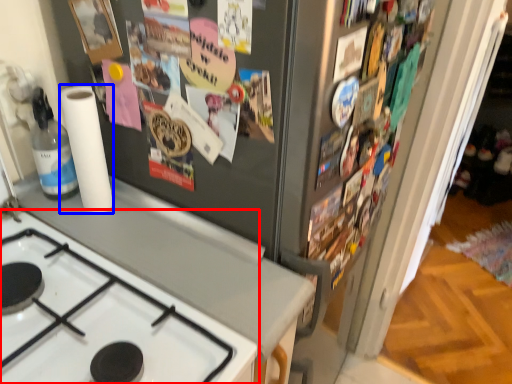
Question: Which object appears closest to the camera in this image, gas stove (highlighted by a red box) or paper towel (highlighted by a blue box)?

Choices:
 (A) gas stove
 (B) paper towel

Answer: (A)